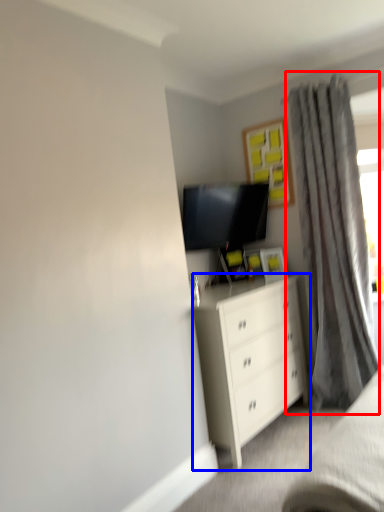
Question: Among these objects, which one is farthest to the camera, curtain (highlighted by a red box) or chest of drawers (highlighted by a blue box)?

Choices:
 (A) curtain
 (B) chest of drawers

Answer: (A)